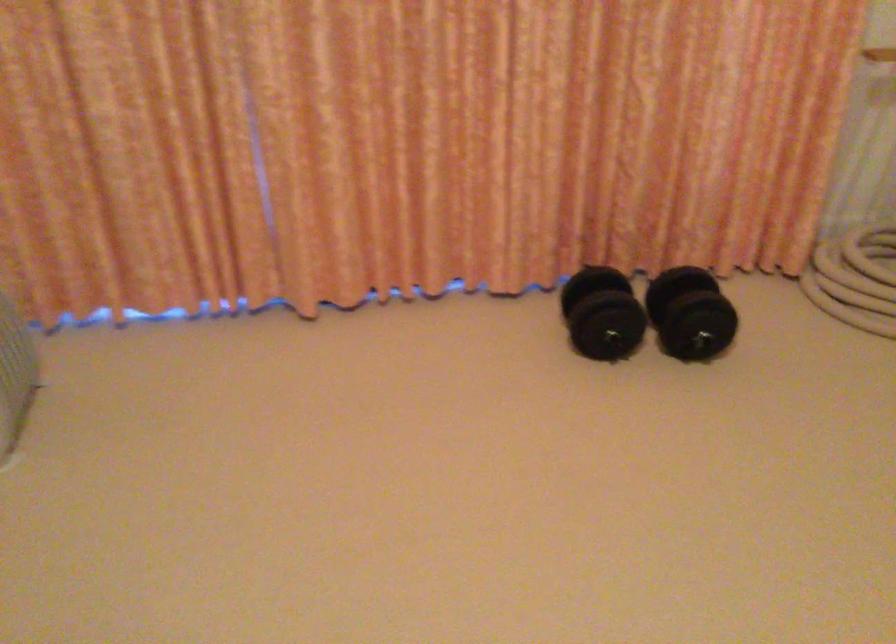
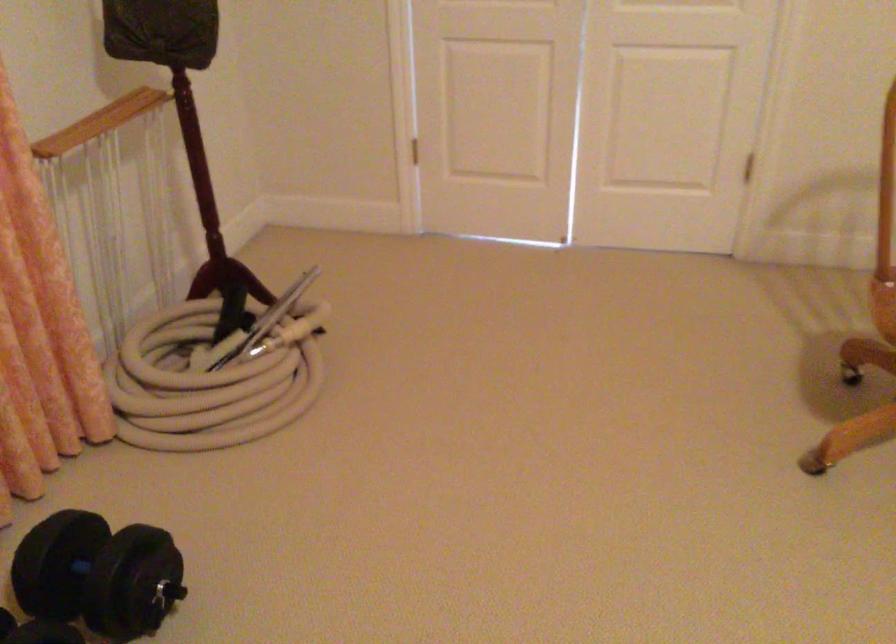
Question: The camera is either moving clockwise (left) or counter-clockwise (right) around the object. The first image is from the beginning of the video and the second image is from the end. Is the camera moving left or right when shooting the video?

Choices:
 (A) Left
 (B) Right

Answer: (A)